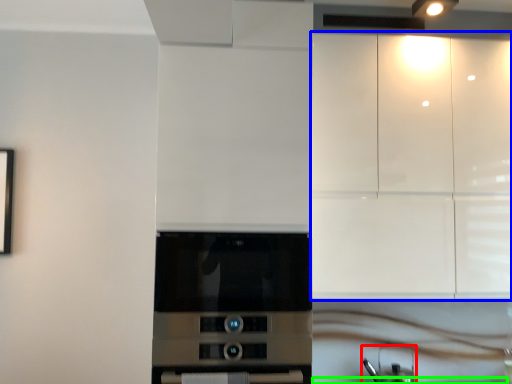
Question: Estimate the real-world distances between objects in this image. Which object is closer to appliance (highlighted by a red box), cabinetry (highlighted by a blue box) or counter top (highlighted by a green box)?

Choices:
 (A) cabinetry
 (B) counter top

Answer: (B)